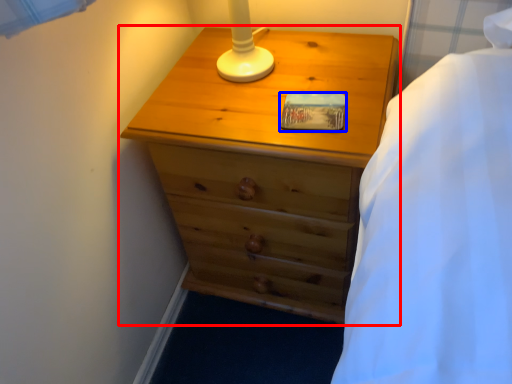
Question: Which object is closer to the camera taking this photo, chest of drawers (highlighted by a red box) or pad (highlighted by a blue box)?

Choices:
 (A) chest of drawers
 (B) pad

Answer: (A)